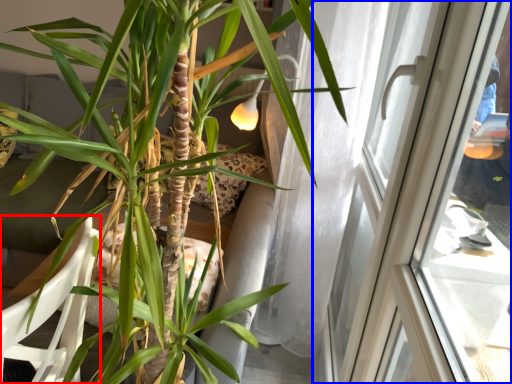
Question: Which object is further to the camera taking this photo, armchair (highlighted by a red box) or window (highlighted by a blue box)?

Choices:
 (A) armchair
 (B) window

Answer: (B)